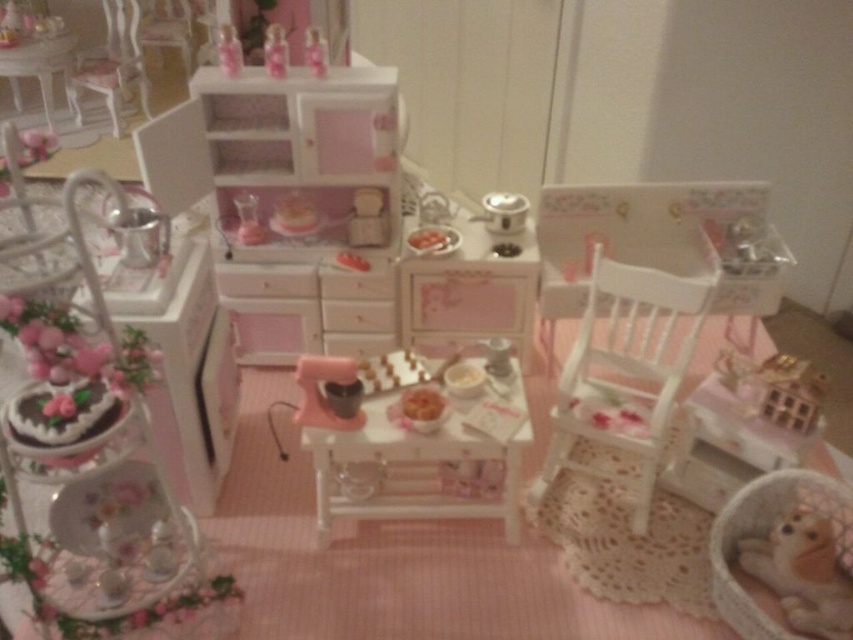
You are a tiny guest in the dollhouse kitchen and want to move from the dining table to the decorative stand. You can only move along the floor. Which point, point (260, 232) or point (227, 44), is closer to your starting position at the dining table?

Point (260, 232) is closer to the dining table because it is further to the viewer, meaning it is nearer to your current position.

You are planning to place a new decorative vase on the white glossy table at upper left and the matte plastic cabinet at upper center. Based on their sizes, which surface can accommodate a wider vase?

The white glossy table at upper left can accommodate a wider vase since its width is larger than the matte plastic cabinet at upper center.

You are a guest at the dollhouse tea party. You notice the fluffy beige dog at lower right and the transparent glass at center. Which object is taller?

The fluffy beige dog at lower right is taller than the transparent glass at center.